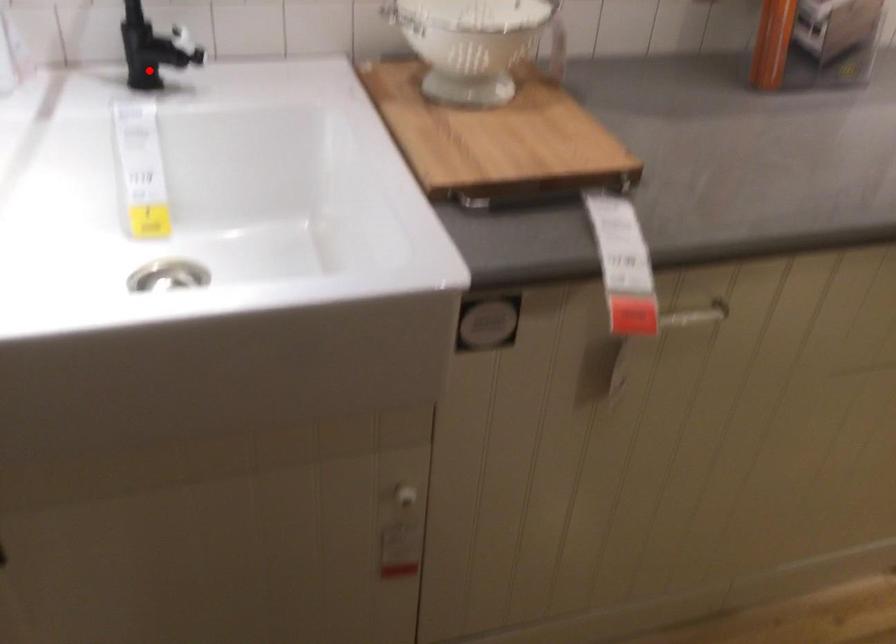
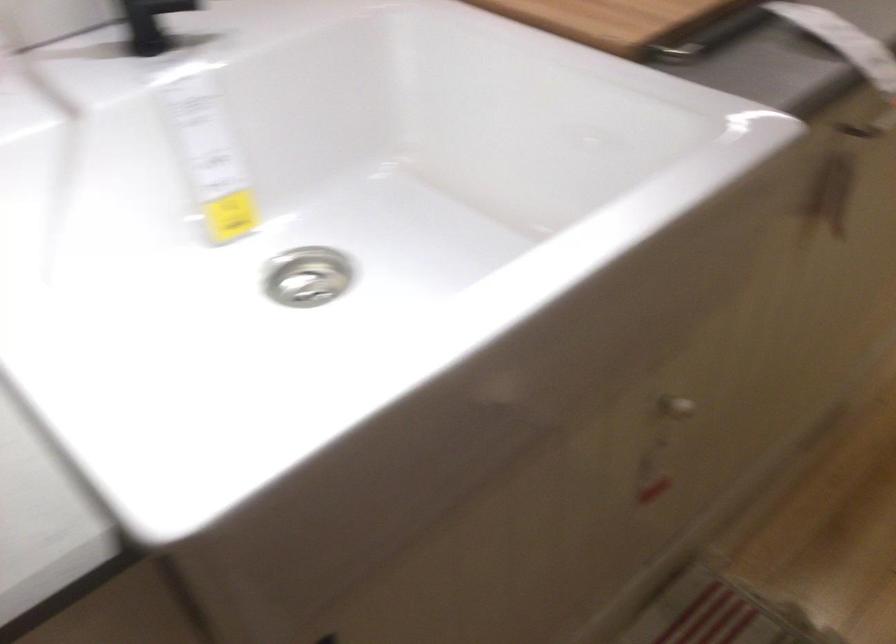
Where in the second image is the point corresponding to the highlighted location from the first image?

(151, 23)